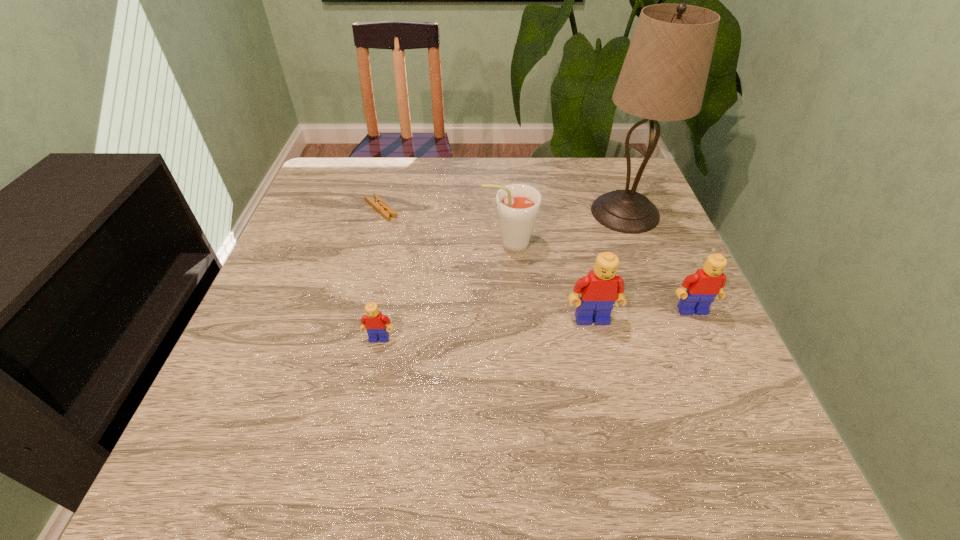
Identify which object is the third closest to the root beer. Please provide its 2D coordinates. Your answer should be formatted as a tuple, i.e. [(x, y)], where the tuple contains the x and y coordinates of a point satisfying the conditions above.

[(386, 211)]

Locate which Lego ranks in proximity to the nearest Lego. Please provide its 2D coordinates. Your answer should be formatted as a tuple, i.e. [(x, y)], where the tuple contains the x and y coordinates of a point satisfying the conditions above.

[(601, 288)]

At what (x,y) coordinates should I click in order to perform the action: click on Lego that is the nearest to the nearest object. Please return your answer as a coordinate pair (x, y). This screenshot has height=540, width=960. Looking at the image, I should click on (601, 288).

Where is `free space that satisfies the following two spatial constraints: 1. on the front-facing side of the tallest object; 2. on the face of the second Lego from right to left`? free space that satisfies the following two spatial constraints: 1. on the front-facing side of the tallest object; 2. on the face of the second Lego from right to left is located at coordinates (666, 319).

Find the location of `vacant space that satisfies the following two spatial constraints: 1. on the front-facing side of the tallest object; 2. on the face of the fourth object from left to right`. vacant space that satisfies the following two spatial constraints: 1. on the front-facing side of the tallest object; 2. on the face of the fourth object from left to right is located at coordinates (666, 319).